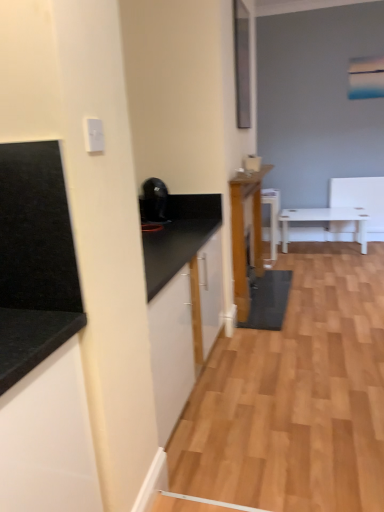
At what (x,y) coordinates should I click in order to perform the action: click on free space in front of wooden cabinet at center, acting as the second cabinetry starting from the left. Please return your answer as a coordinate pair (x, y). Looking at the image, I should click on (302, 338).